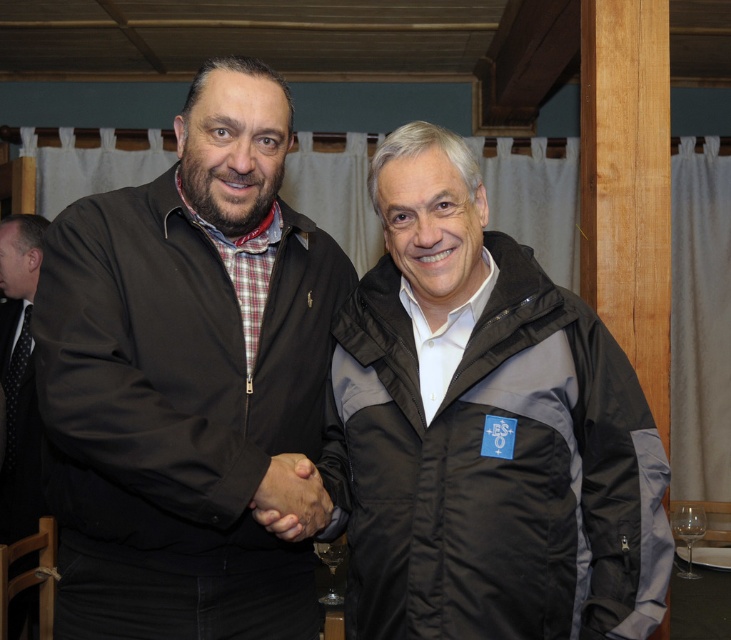
Is matte black jacket at left taller than black textured suit at left?

No, matte black jacket at left is not taller than black textured suit at left.

Is matte black jacket at left below black textured suit at left?

No, matte black jacket at left is not below black textured suit at left.

Between point (48, 358) and point (23, 536), which one is positioned in front?

Point (48, 358) is more forward.

At what (x,y) coordinates should I click in order to perform the action: click on matte black jacket at left. Please return your answer as a coordinate pair (x, y). Image resolution: width=731 pixels, height=640 pixels. Looking at the image, I should click on point(189,381).

Is black puffy jacket at center in front of black textured suit at left?

Yes, it is.

Which is more to the left, black puffy jacket at center or black textured suit at left?

black textured suit at left is more to the left.

Image resolution: width=731 pixels, height=640 pixels. I want to click on black puffy jacket at center, so click(493, 470).

Identify the location of black puffy jacket at center. (493, 470).

Does black textured suit at left come behind transparent glass at lower right?

Yes, it is behind transparent glass at lower right.

What do you see at coordinates (18, 376) in the screenshot? I see `black textured suit at left` at bounding box center [18, 376].

Between point (30, 292) and point (689, 500), which one is positioned behind?

Point (30, 292)

Find the location of a particular element. black textured suit at left is located at coordinates (18, 376).